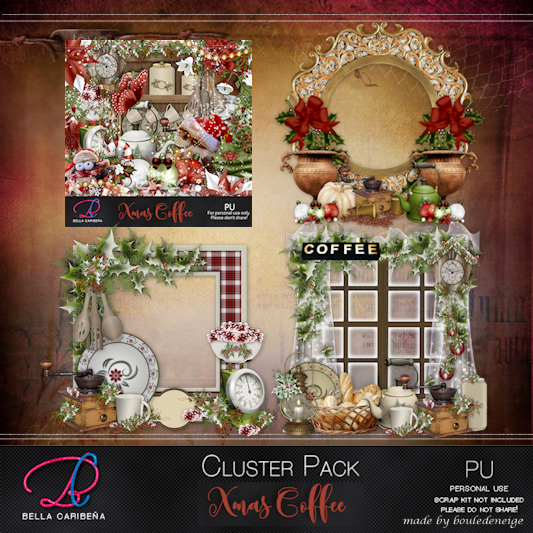
I want to click on red bows, so click(306, 121), click(453, 117).